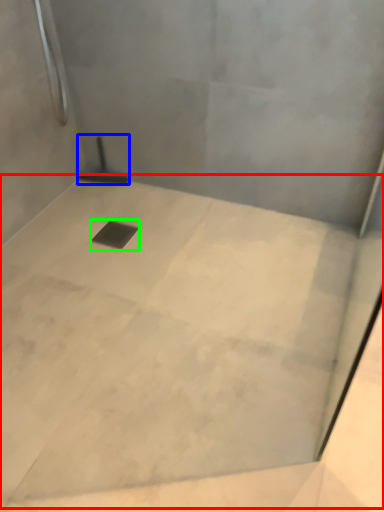
Question: Which is farther away from concrete (highlighted by a red box)? shower (highlighted by a blue box) or drain (highlighted by a green box)?

Choices:
 (A) shower
 (B) drain

Answer: (A)